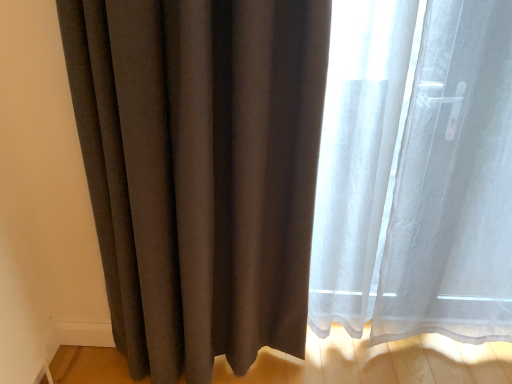
Based on the photo, what is the approximate width of satin white curtain at right?

6.41 inches.

Locate an element on the screen. Image resolution: width=512 pixels, height=384 pixels. satin white curtain at right is located at coordinates (416, 172).

The height and width of the screenshot is (384, 512). Describe the element at coordinates (416, 172) in the screenshot. I see `satin white curtain at right` at that location.

The height and width of the screenshot is (384, 512). I want to click on satin white curtain at right, so click(416, 172).